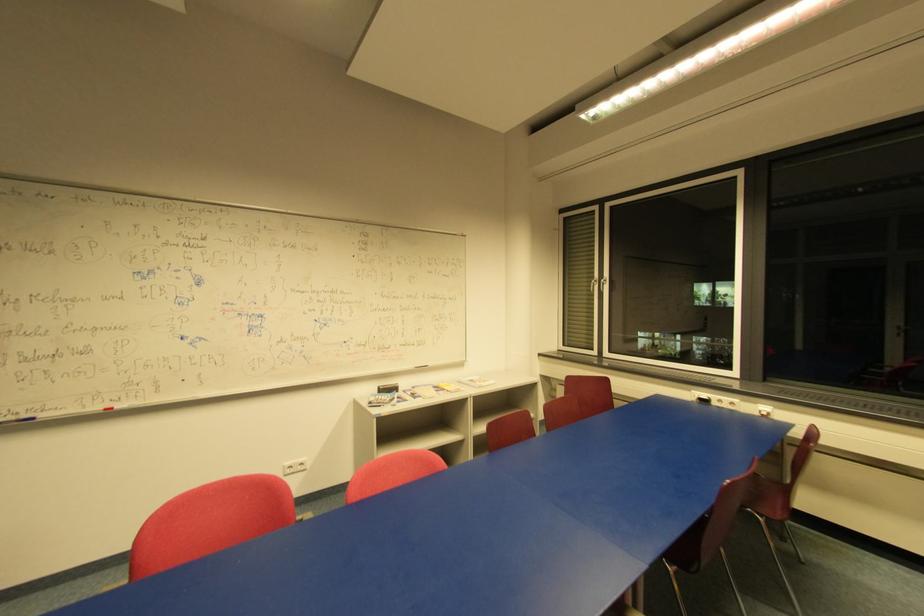
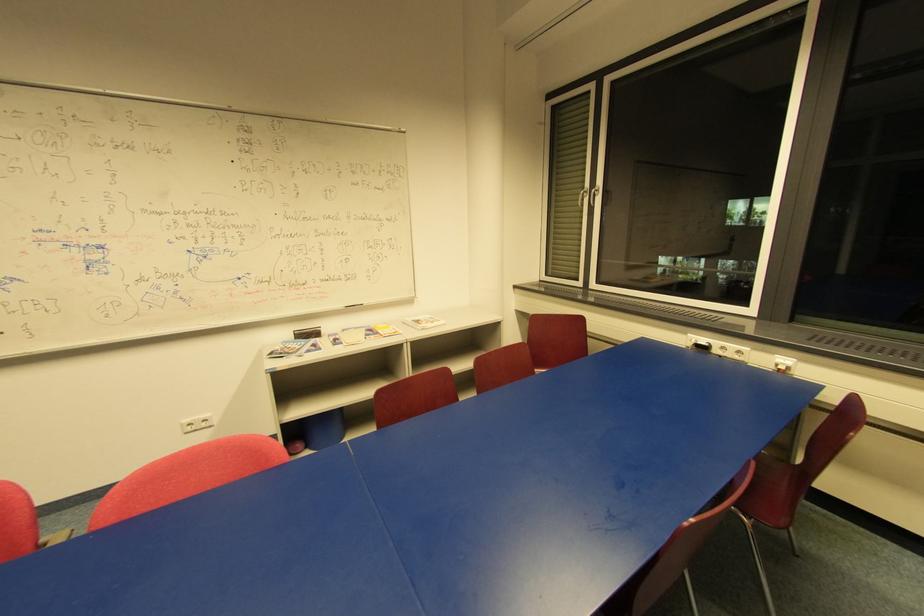
Locate, in the second image, the point that corresponds to point (447, 391) in the first image.

(381, 334)